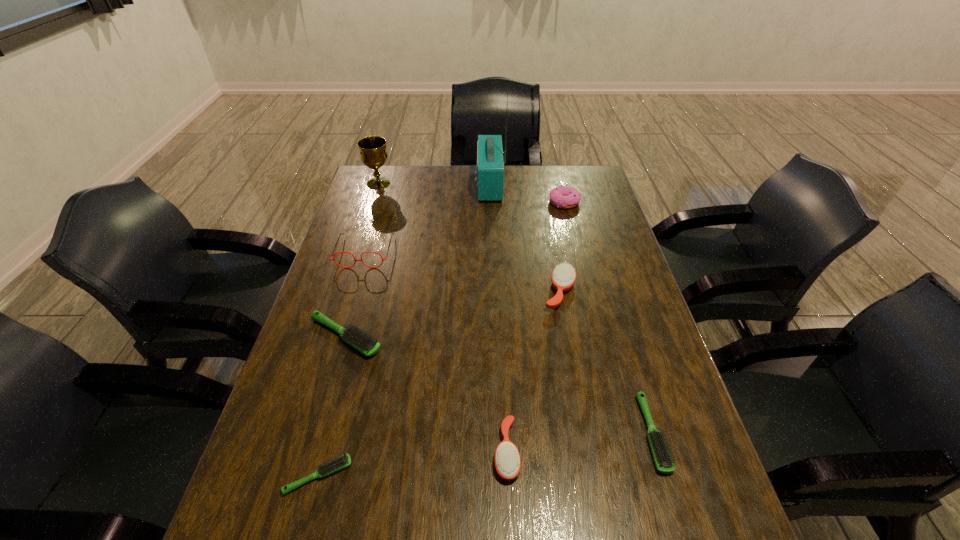
Locate an element on the screen. The image size is (960, 540). vacant space that satisfies the following two spatial constraints: 1. on the front side of the eighth shortest object; 2. on the left side of the biggest light hairbrush is located at coordinates (330, 336).

You are a GUI agent. You are given a task and a screenshot of the screen. Output one action in this format:
    pyautogui.click(x=<x>, y=<y>)
    Task: Click on the vacant space that satisfies the following two spatial constraints: 1. on the back side of the shortest object; 2. on the left side of the fourth hairbrush from left to right
    The image size is (960, 540).
    Given the screenshot: What is the action you would take?
    click(x=368, y=292)

You are a GUI agent. You are given a task and a screenshot of the screen. Output one action in this format:
    pyautogui.click(x=<x>, y=<y>)
    Task: Click on the vacant space that satisfies the following two spatial constraints: 1. on the back side of the smaller orange hairbrush; 2. on the front panel of the tallest object
    The image size is (960, 540).
    Given the screenshot: What is the action you would take?
    pyautogui.click(x=494, y=185)

Where is `free space that satisfies the following two spatial constraints: 1. on the back side of the third hairbrush from left to right; 2. on the front panel of the radio receiver`? free space that satisfies the following two spatial constraints: 1. on the back side of the third hairbrush from left to right; 2. on the front panel of the radio receiver is located at coordinates (494, 185).

This screenshot has height=540, width=960. In order to click on vacant area that satisfies the following two spatial constraints: 1. on the front-facing side of the spectacles; 2. on the left side of the sixth farthest object in this screenshot , I will do `click(340, 336)`.

Identify the location of free space that satisfies the following two spatial constraints: 1. on the front side of the farthest light hairbrush; 2. on the left side of the smallest light hairbrush. (305, 476).